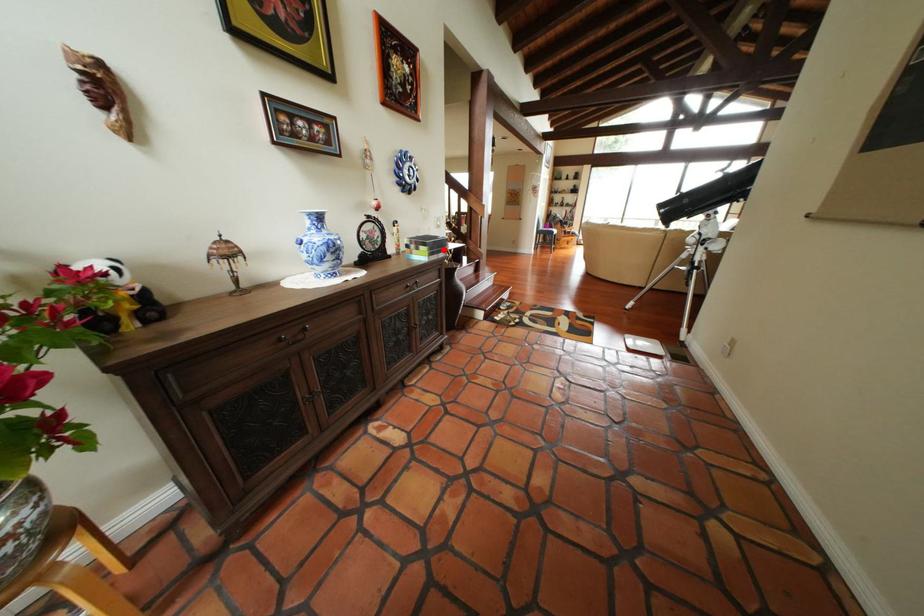
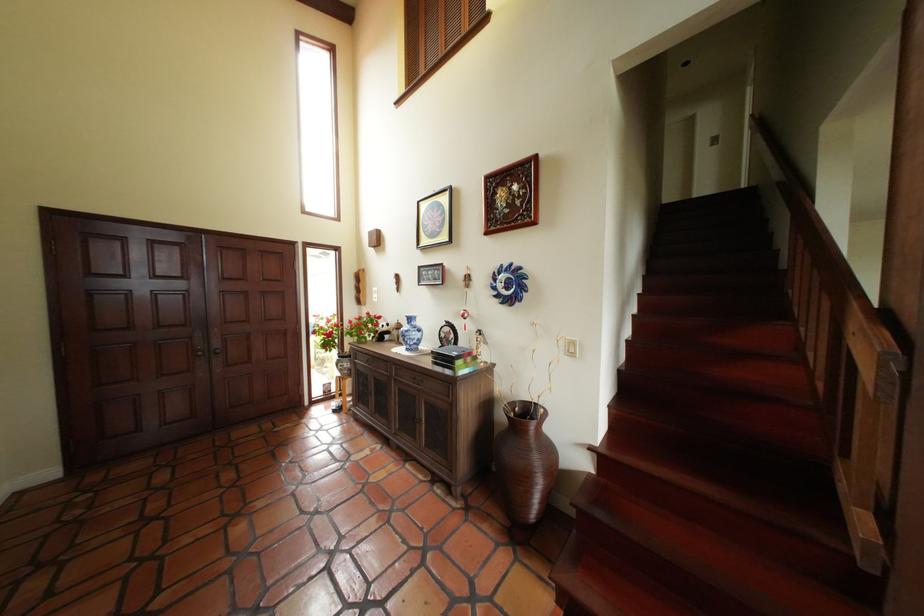
Question: I am providing you with two images of the same scene from different viewpoints. Image1 has a red point marked. In image2, the corresponding 3D location appears at what relative position? Reply with the corresponding letter.

Choices:
 (A) Closer
 (B) Farther

Answer: (B)